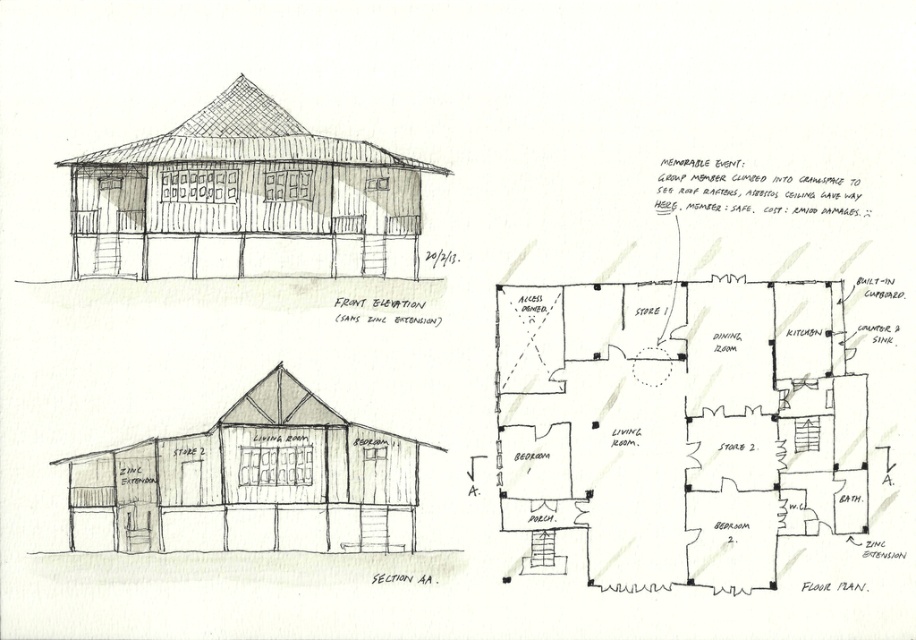
Question: Among these points, which one is farthest from the camera?

Choices:
 (A) 267,116
 (B) 303,460

Answer: (A)

Question: Observing the image, what is the correct spatial positioning of wooden planks barn at center in reference to wooden hut at center?

Choices:
 (A) below
 (B) above

Answer: (B)

Question: Does wooden planks barn at center have a greater width compared to wooden hut at center?

Choices:
 (A) no
 (B) yes

Answer: (B)

Question: Which point is farther to the camera?

Choices:
 (A) wooden hut at center
 (B) wooden planks barn at center

Answer: (B)

Question: Is wooden planks barn at center positioned before wooden hut at center?

Choices:
 (A) yes
 (B) no

Answer: (B)